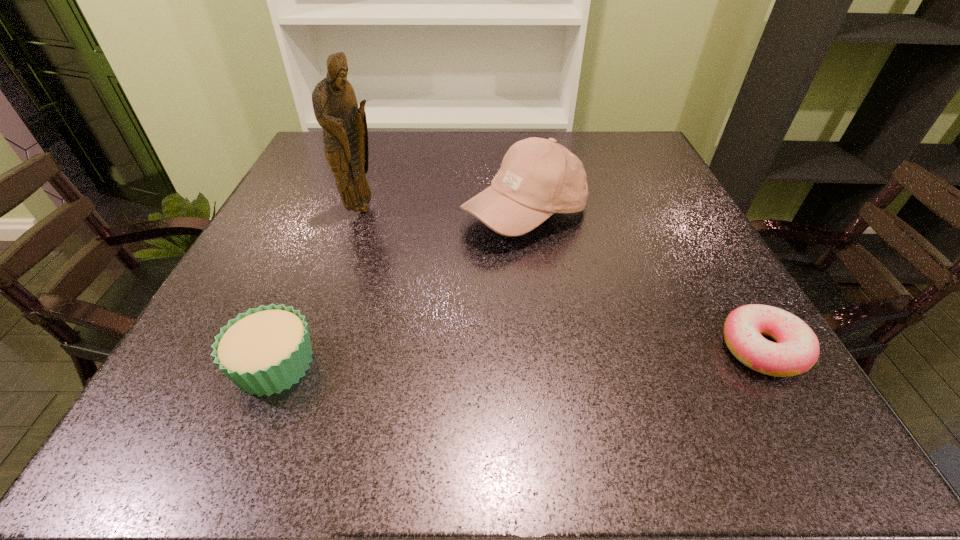
Find the location of a particular element. This screenshot has width=960, height=540. free spot on the desktop that is between the third tallest object and the rightmost object and is positioned on the front-facing side of the figurine is located at coordinates (521, 356).

The width and height of the screenshot is (960, 540). Find the location of `free spot on the desktop that is between the second shortest object and the rightmost object and is positioned on the front-facing side of the third shortest object`. free spot on the desktop that is between the second shortest object and the rightmost object and is positioned on the front-facing side of the third shortest object is located at coordinates (573, 355).